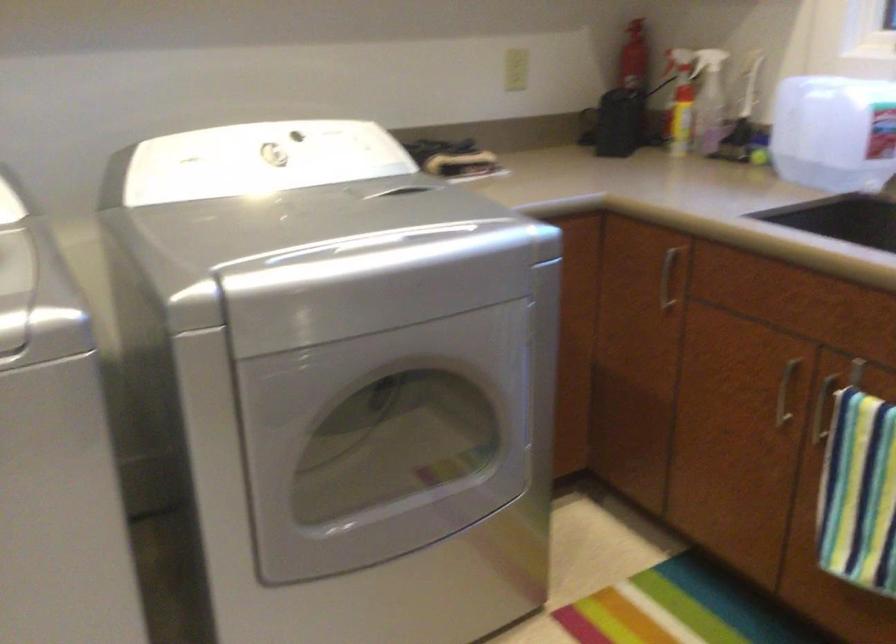
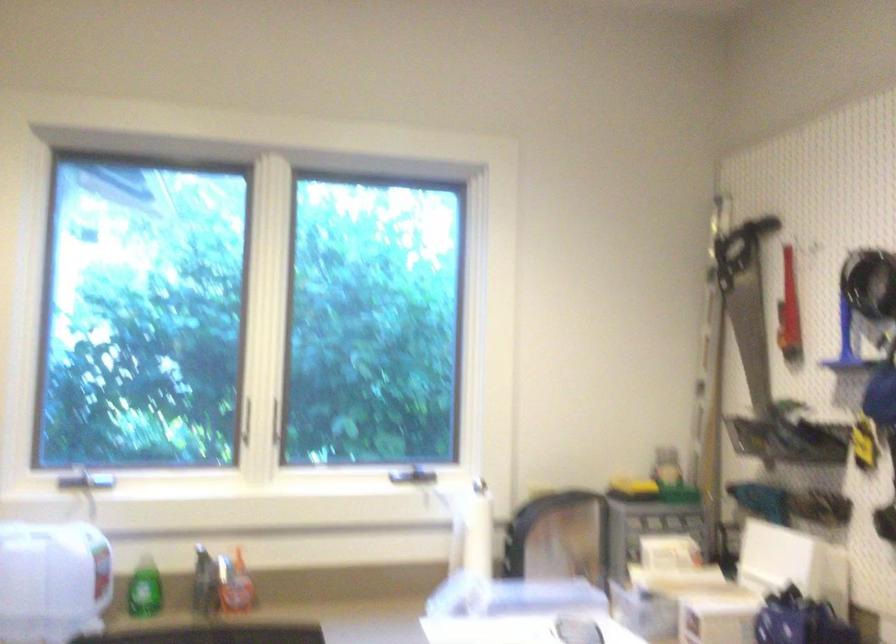
Question: The camera is either moving clockwise (left) or counter-clockwise (right) around the object. The first image is from the beginning of the video and the second image is from the end. Is the camera moving left or right when shooting the video?

Choices:
 (A) Left
 (B) Right

Answer: (A)